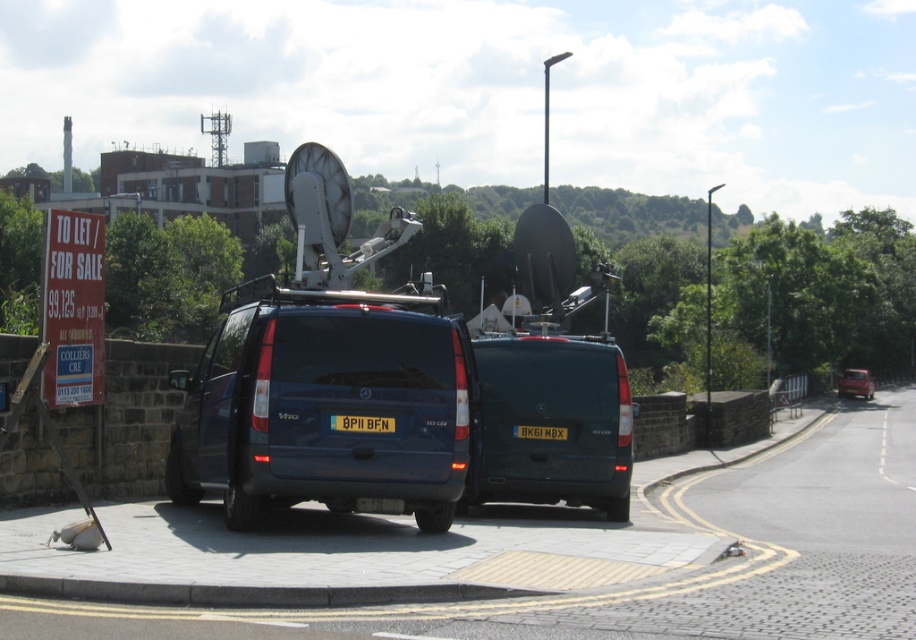
Question: Is matte black van at center to the right of yellow matte license plate at rear from the viewer's perspective?

Choices:
 (A) no
 (B) yes

Answer: (A)

Question: Does matte black van at center lie in front of yellow matte license plate at rear?

Choices:
 (A) yes
 (B) no

Answer: (A)

Question: Is matte black van at center below yellow matte license plate at rear?

Choices:
 (A) yes
 (B) no

Answer: (A)

Question: Considering the real-world distances, which object is closest to the metallic red car at right?

Choices:
 (A) matte black van at center
 (B) black plastic license plate at rear
 (C) yellow matte license plate at rear

Answer: (B)

Question: Which of the following is the farthest from the observer?

Choices:
 (A) (531, 435)
 (B) (857, 369)
 (C) (339, 419)
 (D) (433, 464)

Answer: (B)

Question: Which point is closer to the camera taking this photo?

Choices:
 (A) (846, 381)
 (B) (393, 337)

Answer: (B)